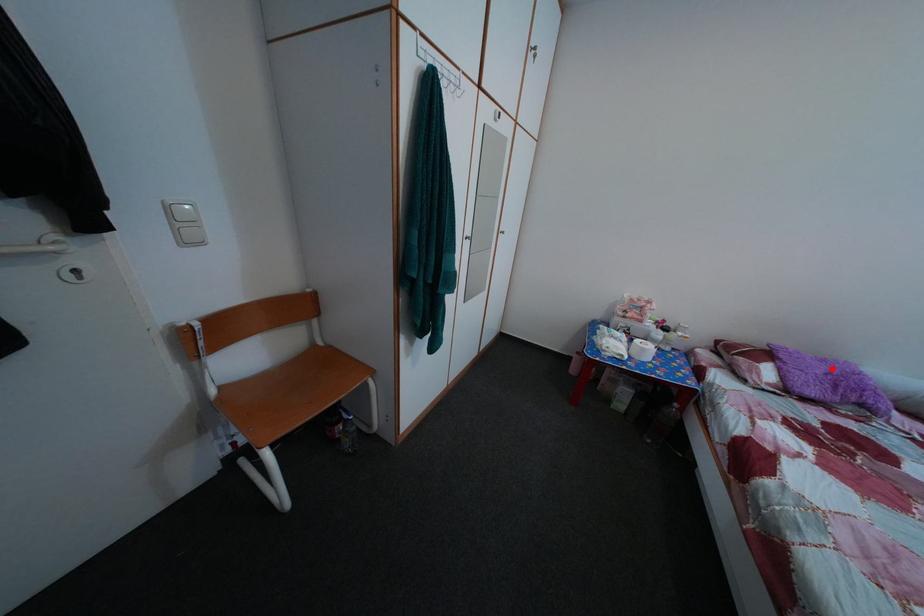
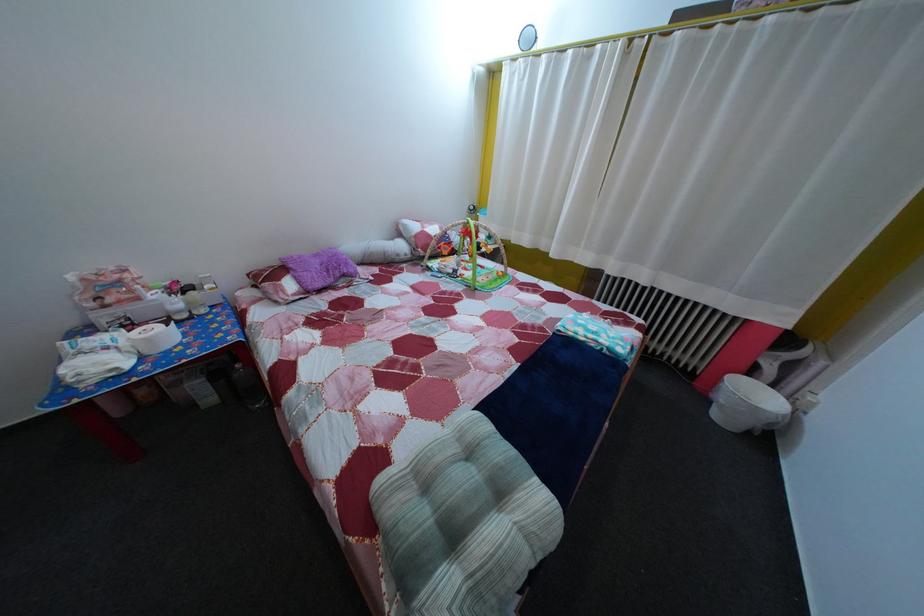
In the second image, find the point that corresponds to the highlighted location in the first image.

(325, 262)